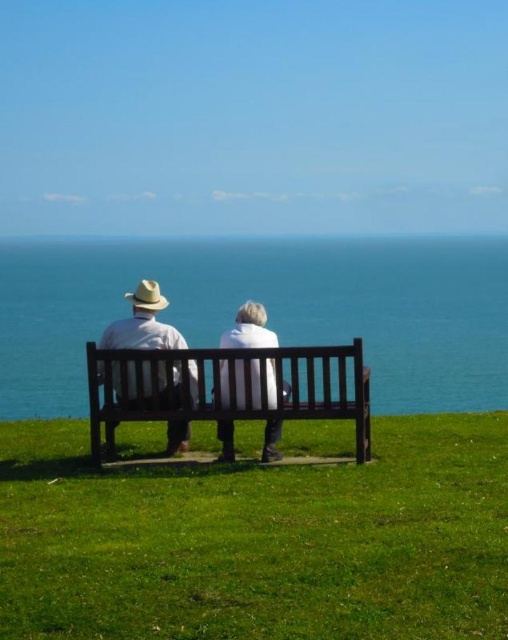
Question: Which point appears closest to the camera in this image?

Choices:
 (A) (411, 244)
 (B) (220, 531)
 (C) (147, 324)

Answer: (B)

Question: Is green grass at center thinner than wooden bench at center?

Choices:
 (A) no
 (B) yes

Answer: (A)

Question: Among these objects, which one is farthest from the camera?

Choices:
 (A) white matte jacket at center
 (B) green grass at center
 (C) blue water at center

Answer: (A)

Question: Is blue water at center below wooden bench at center?

Choices:
 (A) no
 (B) yes

Answer: (A)

Question: Which is nearer to the green grass at center?

Choices:
 (A) matte white shirt at center
 (B) white matte jacket at center
 (C) blue water at center

Answer: (B)

Question: Is blue water at center behind wooden bench at center?

Choices:
 (A) no
 (B) yes

Answer: (B)